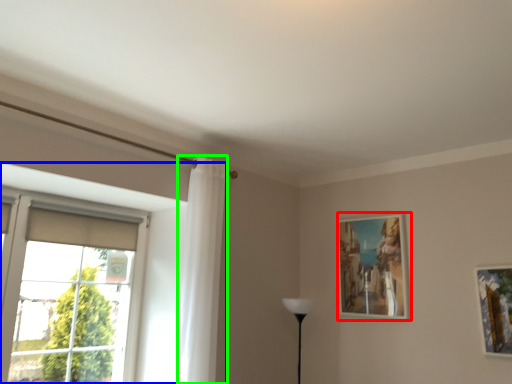
Question: Which object is positioned farthest from picture frame (highlighted by a red box)? Select from window (highlighted by a blue box) and curtain (highlighted by a green box).

Choices:
 (A) window
 (B) curtain

Answer: (A)